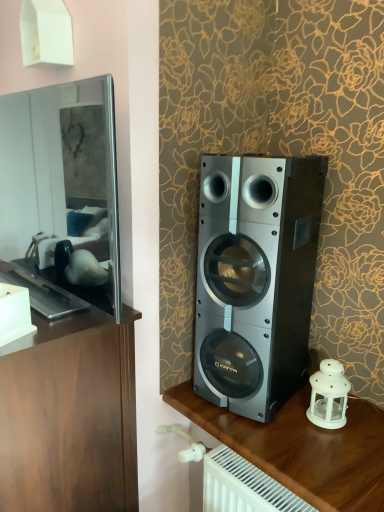
Question: From the image's perspective, is metallic silver speaker at right, marked as the 2th furniture in a left-to-right arrangement, on top of matte black mirror at left?

Choices:
 (A) yes
 (B) no

Answer: (B)

Question: Does metallic silver speaker at right, marked as the 2th furniture in a left-to-right arrangement, have a greater height compared to matte black mirror at left?

Choices:
 (A) yes
 (B) no

Answer: (A)

Question: Does metallic silver speaker at right, acting as the first furniture starting from the right, have a smaller size compared to matte black mirror at left?

Choices:
 (A) yes
 (B) no

Answer: (B)

Question: Is metallic silver speaker at right, acting as the first furniture starting from the right, thinner than matte black mirror at left?

Choices:
 (A) yes
 (B) no

Answer: (B)

Question: From a real-world perspective, is metallic silver speaker at right, marked as the 2th furniture in a left-to-right arrangement, physically below matte black mirror at left?

Choices:
 (A) yes
 (B) no

Answer: (A)

Question: Is metallic silver speaker at right, acting as the first furniture starting from the right, facing towards matte black mirror at left?

Choices:
 (A) yes
 (B) no

Answer: (B)

Question: Is there a large distance between white matte lantern at lower right and matte black mirror at left?

Choices:
 (A) no
 (B) yes

Answer: (A)

Question: From the image's perspective, is white matte lantern at lower right over matte black mirror at left?

Choices:
 (A) yes
 (B) no

Answer: (B)

Question: From a real-world perspective, is white matte lantern at lower right physically below matte black mirror at left?

Choices:
 (A) no
 (B) yes

Answer: (B)

Question: Is white matte lantern at lower right wider than matte black mirror at left?

Choices:
 (A) yes
 (B) no

Answer: (B)

Question: Is white matte lantern at lower right to the right of matte black mirror at left from the viewer's perspective?

Choices:
 (A) no
 (B) yes

Answer: (B)

Question: Is white matte lantern at lower right bigger than matte black mirror at left?

Choices:
 (A) no
 (B) yes

Answer: (A)

Question: Is wooden cabinet at left, the 1th furniture viewed from the left, bigger than silver metallic speaker at center?

Choices:
 (A) no
 (B) yes

Answer: (B)